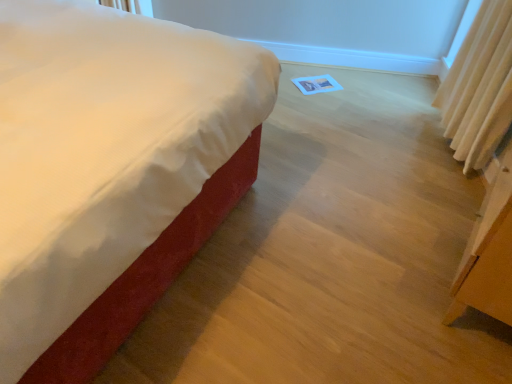
Locate an element on the screen. This screenshot has height=384, width=512. free space behind beige fabric curtain at right is located at coordinates (416, 128).